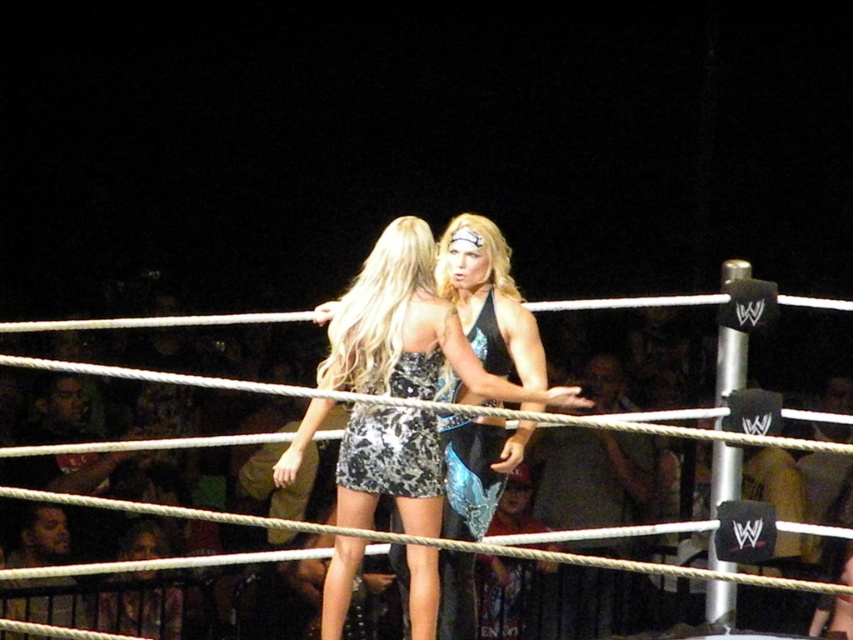
Measure the distance between sparkly metallic dress at center and shiny metallic dress at center.

sparkly metallic dress at center and shiny metallic dress at center are 29.92 centimeters apart.

Between point (335, 490) and point (476, 316), which one is positioned behind?

Point (335, 490)

Describe the element at coordinates (409, 330) in the screenshot. This screenshot has width=853, height=640. I see `sparkly metallic dress at center` at that location.

In order to click on sparkly metallic dress at center in this screenshot , I will do `click(409, 330)`.

Who is positioned more to the left, sparkly metallic dress at center or sparkly black dress at center?

sparkly black dress at center is more to the left.

How distant is sparkly metallic dress at center from sparkly black dress at center?

sparkly metallic dress at center is 6.44 inches from sparkly black dress at center.

Measure the distance between point (x=352, y=560) and camera.

5.69 meters

Locate an element on the screen. Image resolution: width=853 pixels, height=640 pixels. sparkly metallic dress at center is located at coordinates (409, 330).

Which of these two, sparkly black dress at center or shiny metallic dress at center, stands taller?

With more height is shiny metallic dress at center.

Is sparkly black dress at center further to camera compared to shiny metallic dress at center?

No.

Describe the element at coordinates (390, 452) in the screenshot. I see `sparkly black dress at center` at that location.

Find the location of a particular element. Image resolution: width=853 pixels, height=640 pixels. sparkly black dress at center is located at coordinates (390, 452).